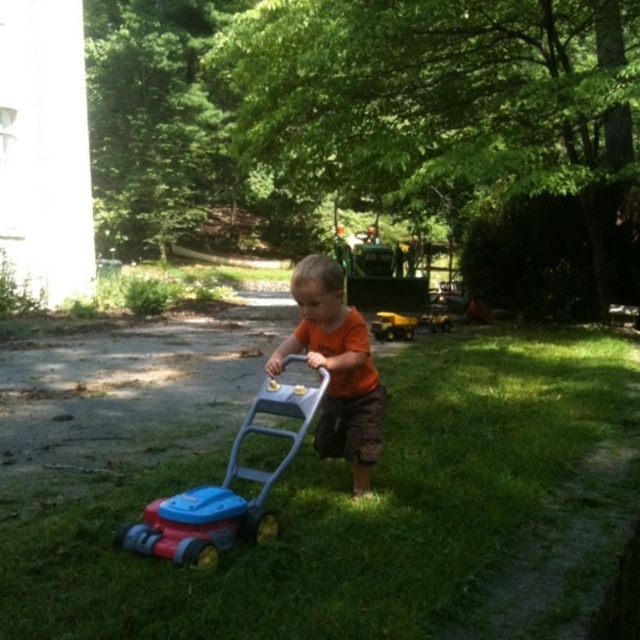
This screenshot has width=640, height=640. Describe the element at coordinates (346, 508) in the screenshot. I see `green grass at center` at that location.

Does green grass at center have a smaller size compared to blue plastic toy lawn mower at center?

No, green grass at center is not smaller than blue plastic toy lawn mower at center.

Does point (403, 451) lie in front of point (196, 564)?

No.

The height and width of the screenshot is (640, 640). I want to click on green grass at center, so tap(346, 508).

Between blue plastic toy lawn mower at center and yellow plastic tractor at center, which one has more height?

With more height is blue plastic toy lawn mower at center.

Does point (154, 544) come behind point (404, 336)?

No, (154, 544) is in front of (404, 336).

Does point (154, 508) come farther from viewer compared to point (412, 321)?

No, it is not.

Identify the location of blue plastic toy lawn mower at center. Image resolution: width=640 pixels, height=640 pixels. (225, 492).

Does green grass at center appear over orange matte shirt at center?

No.

Who is positioned more to the right, green grass at center or orange matte shirt at center?

green grass at center

At what (x,y) coordinates should I click in order to perform the action: click on green grass at center. Please return your answer as a coordinate pair (x, y). Image resolution: width=640 pixels, height=640 pixels. Looking at the image, I should click on (346, 508).